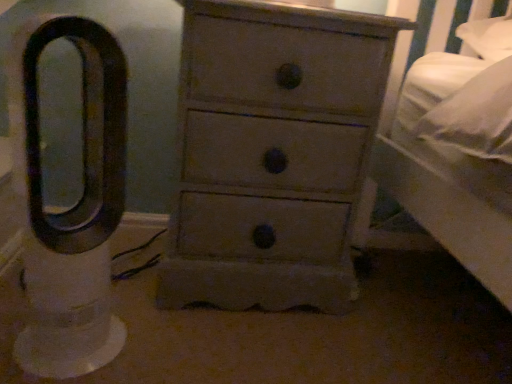
Question: Considering the positions of point (279, 29) and point (93, 291), is point (279, 29) closer or farther from the camera than point (93, 291)?

Choices:
 (A) closer
 (B) farther

Answer: (B)

Question: From their relative heights in the image, would you say matte gray chest of drawers at center is taller or shorter than white plastic fan at left?

Choices:
 (A) tall
 (B) short

Answer: (A)

Question: Is matte gray chest of drawers at center bigger or smaller than white plastic fan at left?

Choices:
 (A) big
 (B) small

Answer: (A)

Question: Looking at their shapes, would you say white plastic fan at left is wider or thinner than matte gray chest of drawers at center?

Choices:
 (A) thin
 (B) wide

Answer: (A)

Question: From a real-world perspective, is white plastic fan at left positioned above or below matte gray chest of drawers at center?

Choices:
 (A) above
 (B) below

Answer: (B)

Question: In the image, is white plastic fan at left positioned in front of or behind matte gray chest of drawers at center?

Choices:
 (A) front
 (B) behind

Answer: (A)

Question: From the image's perspective, is white plastic fan at left positioned above or below matte gray chest of drawers at center?

Choices:
 (A) above
 (B) below

Answer: (B)